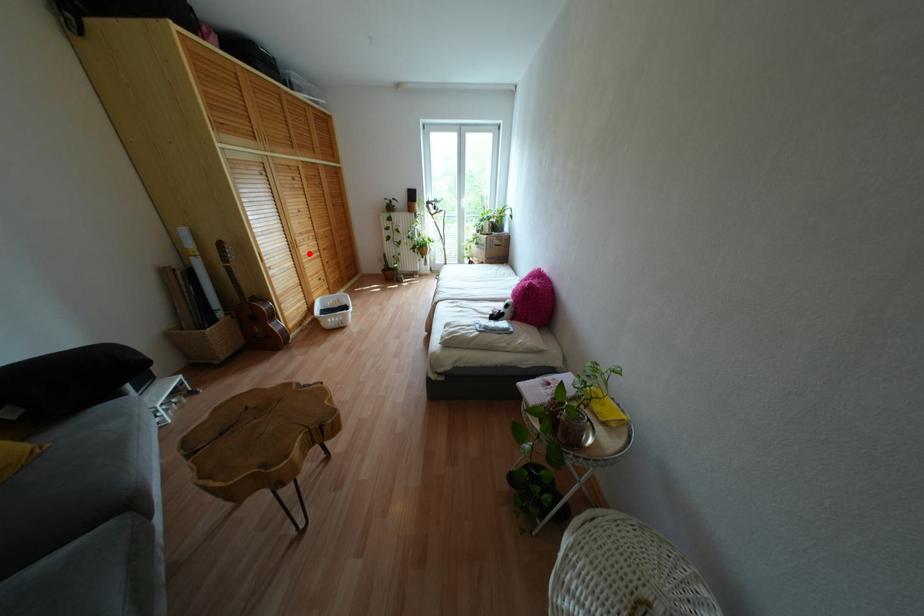
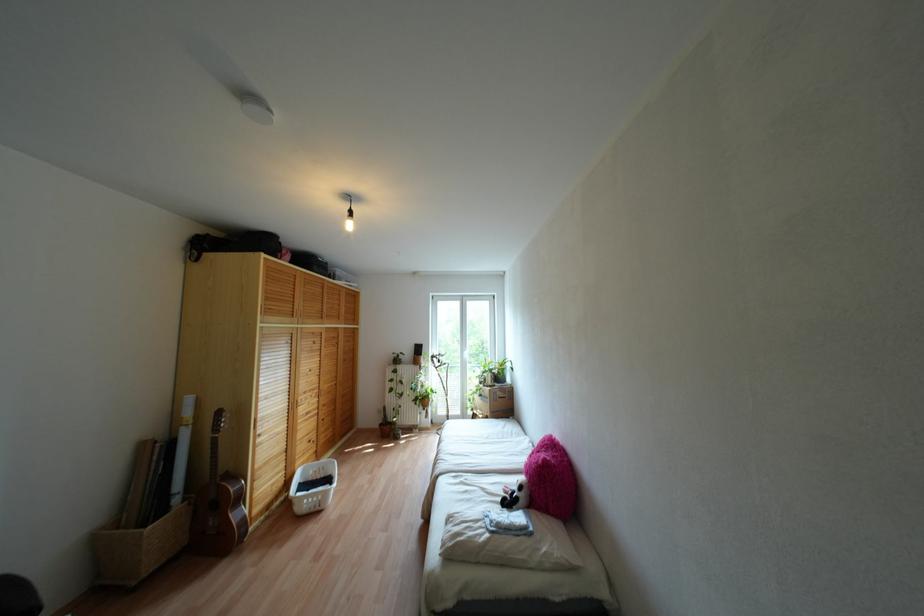
Question: I am providing you with two images of the same scene from different viewpoints. Given a red point in image1, look at the same physical point in image2. Is it:

Choices:
 (A) Closer to the viewpoint
 (B) Farther from the viewpoint

Answer: (B)